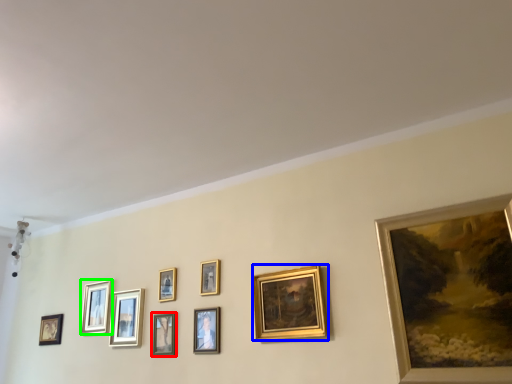
Question: Estimate the real-world distances between objects in this image. Which object is farther from picture frame (highlighted by a red box), picture frame (highlighted by a blue box) or picture frame (highlighted by a green box)?

Choices:
 (A) picture frame
 (B) picture frame

Answer: (A)